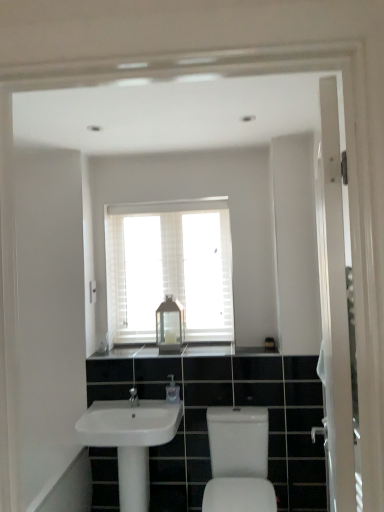
Question: Considering the positions of matte silver tap at center and white glossy sink at lower left, which is counted as the 2th sink, starting from the right, in the image, is matte silver tap at center wider or thinner than white glossy sink at lower left, which is counted as the 2th sink, starting from the right,?

Choices:
 (A) thin
 (B) wide

Answer: (A)

Question: Is matte silver tap at center situated inside white glossy sink at lower left, which is counted as the 2th sink, starting from the right, or outside?

Choices:
 (A) inside
 (B) outside

Answer: (B)

Question: Which object is positioned farthest from the black granite countertop at center?

Choices:
 (A) white glossy sink at lower left, which is counted as the 2th sink, starting from the right
 (B) white wooden window at center
 (C) clear plastic soap dispenser at center
 (D) white glossy sink at lower center, acting as the 2th sink starting from the left
 (E) metallic glass lantern at center

Answer: (D)

Question: Which is farther from the black granite countertop at center?

Choices:
 (A) white glossy sink at lower center, placed as the 1th sink when sorted from right to left
 (B) metallic glass lantern at center
 (C) clear plastic soap dispenser at center
 (D) matte silver tap at center
 (E) white wooden window at center

Answer: (A)